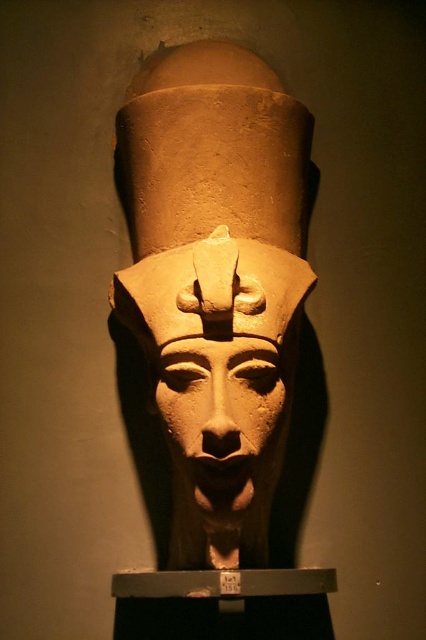
Is matte clay head at center further to the viewer compared to matte stone face at center?

Yes.

Based on the photo, can you confirm if matte clay head at center is wider than matte stone face at center?

Indeed, matte clay head at center has a greater width compared to matte stone face at center.

What do you see at coordinates (215, 282) in the screenshot? I see `matte clay head at center` at bounding box center [215, 282].

Where is `matte clay head at center`? This screenshot has width=426, height=640. matte clay head at center is located at coordinates (215, 282).